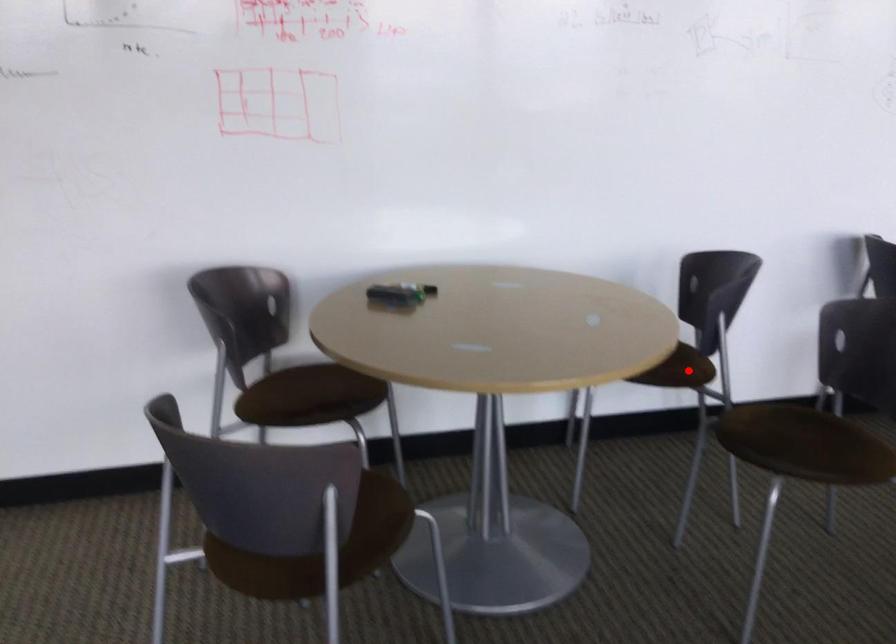
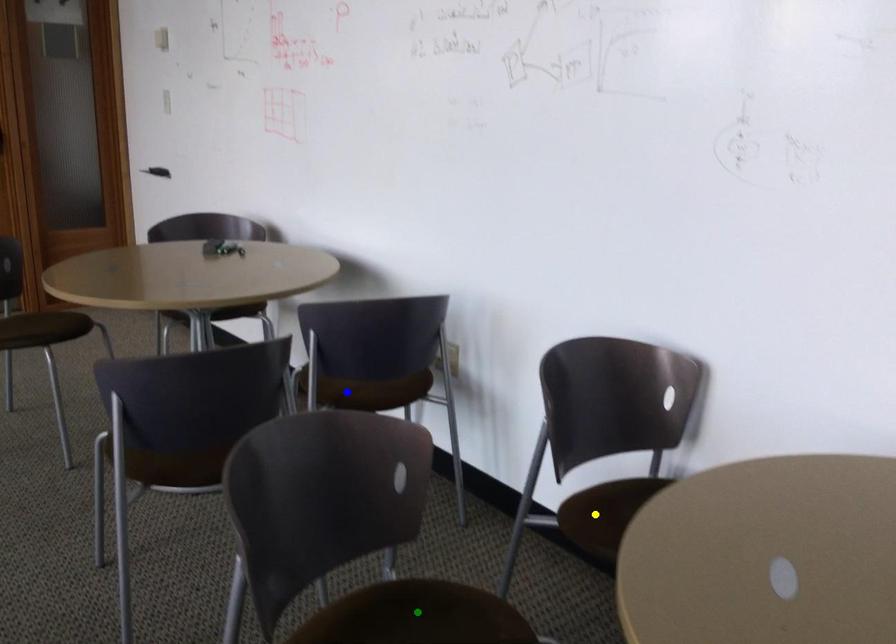
Question: I am providing you with two images of the same scene from different viewpoints. A red point is marked on the first image. You are given multiple points on the second image. Which mark in image 2 goes with the point in image 1?

Choices:
 (A) blue point
 (B) yellow point
 (C) green point

Answer: (A)